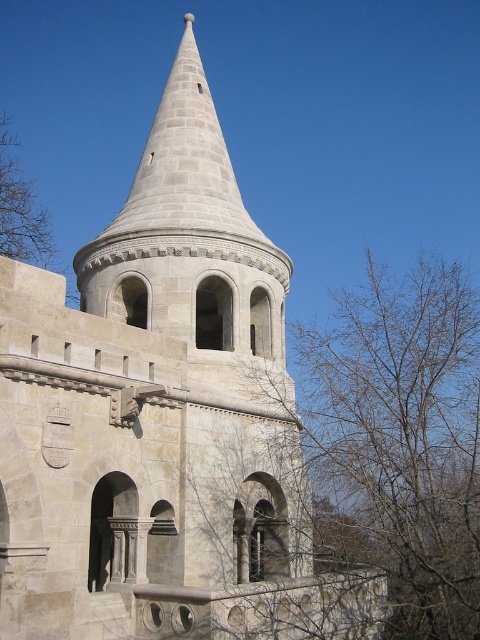
Consider the image. Can you confirm if bare branches at lower right is bigger than brown leafless tree at upper left?

Correct, bare branches at lower right is larger in size than brown leafless tree at upper left.

Who is more distant from viewer, (454, 396) or (4, 179)?

Point (4, 179)

Is point (476, 580) in front of point (34, 262)?

Yes.

Find the location of a particular element. This screenshot has width=480, height=640. bare branches at lower right is located at coordinates (396, 442).